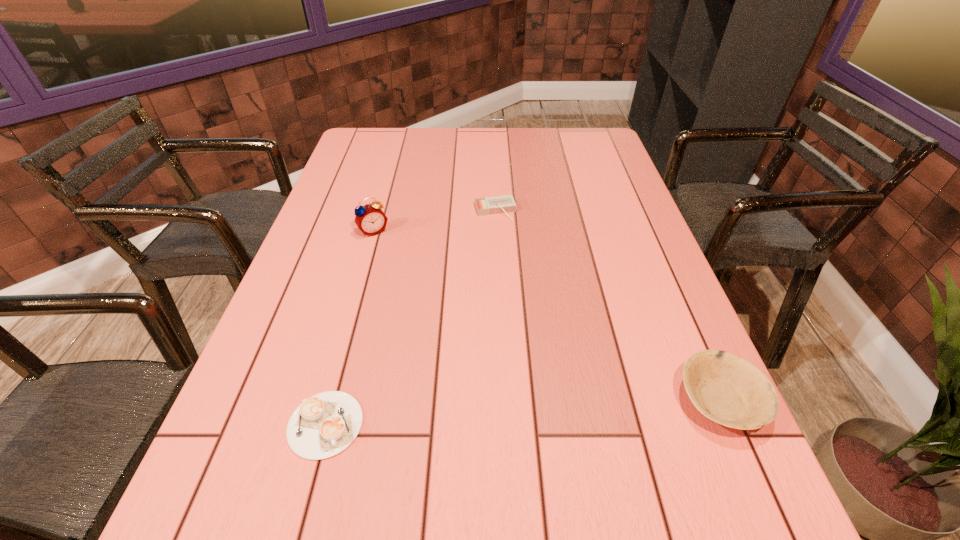
In order to click on vacant region located on the front-facing side of the tallest object in this screenshot , I will do `click(417, 294)`.

Find the location of a particular element. This screenshot has height=540, width=960. blank space located on the front-facing side of the tallest object is located at coordinates (412, 287).

Locate an element on the screen. free space located 0.350m on the striking surface of the farthest object is located at coordinates pyautogui.click(x=532, y=310).

Where is `vacant space located on the striking surface of the farthest object`? vacant space located on the striking surface of the farthest object is located at coordinates click(530, 304).

This screenshot has width=960, height=540. I want to click on free location located 0.140m on the striking surface of the farthest object, so click(x=511, y=252).

Where is `cappuccino that is at the near edge`? The width and height of the screenshot is (960, 540). cappuccino that is at the near edge is located at coordinates (325, 424).

I want to click on bowl present at the near edge, so click(x=726, y=388).

Identify the location of cappuccino that is at the left edge. [x=325, y=424].

The height and width of the screenshot is (540, 960). What are the coordinates of `alarm clock positioned at the left edge` in the screenshot? It's located at (370, 219).

This screenshot has height=540, width=960. In order to click on object located at the right edge in this screenshot , I will do `click(726, 388)`.